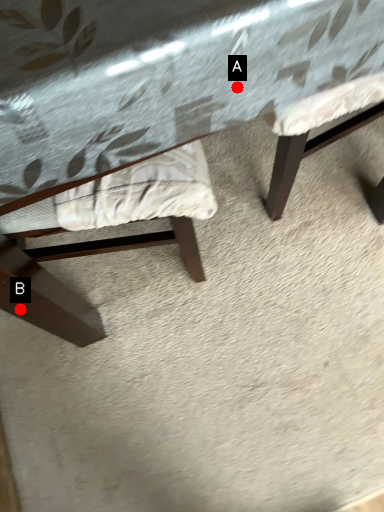
Question: Two points are circled on the image, labeled by A and B beside each circle. Which point is farther to the camera?

Choices:
 (A) A is further
 (B) B is further

Answer: (B)